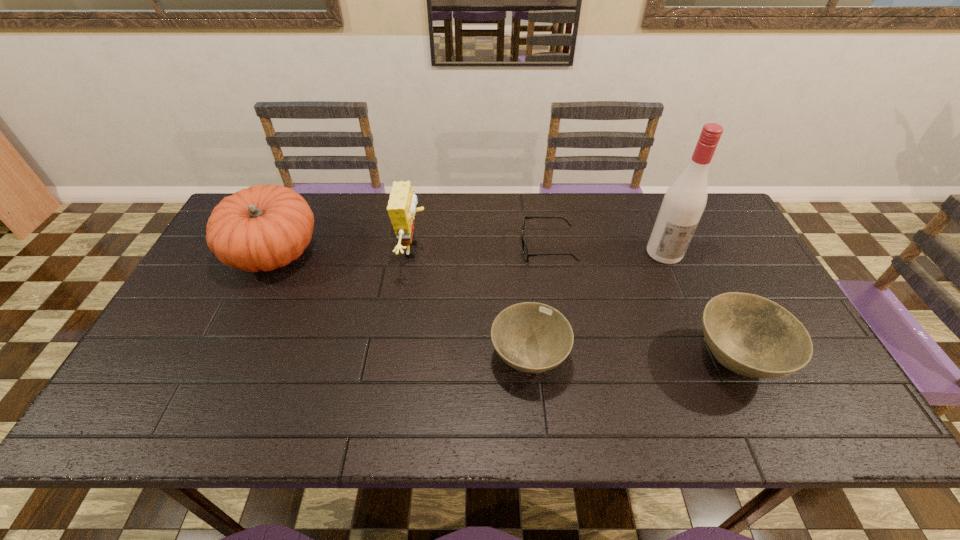
This screenshot has width=960, height=540. In order to click on free spot between the right bowl and the fifth object from right to left in this screenshot , I will do `click(574, 305)`.

Where is `free point between the right bowl and the sponge`? The height and width of the screenshot is (540, 960). free point between the right bowl and the sponge is located at coordinates (574, 305).

This screenshot has height=540, width=960. In order to click on free space between the pumpkin and the taller bowl in this screenshot , I will do `click(505, 306)`.

This screenshot has width=960, height=540. I want to click on free point between the leftmost object and the tallest object, so click(469, 253).

In order to click on empty space that is in between the tallest object and the sponge in this screenshot , I will do `click(540, 251)`.

Image resolution: width=960 pixels, height=540 pixels. Identify the location of unoccupied area between the shorter bowl and the fifth object from right to left. (471, 304).

Where is `object that is the second nearest to the spectacles`? This screenshot has width=960, height=540. object that is the second nearest to the spectacles is located at coordinates (531, 337).

Locate an element on the screen. object that stands as the fifth closest to the shortest object is located at coordinates (264, 227).

The height and width of the screenshot is (540, 960). Find the location of `vacant space that satisfies the following two spatial constraints: 1. on the label of the alcohol; 2. on the left side of the fourth tallest object`. vacant space that satisfies the following two spatial constraints: 1. on the label of the alcohol; 2. on the left side of the fourth tallest object is located at coordinates (709, 360).

The width and height of the screenshot is (960, 540). Find the location of `vacant position in the image that satisfies the following two spatial constraints: 1. on the face of the second object from left to right; 2. on the back side of the shorter bowl`. vacant position in the image that satisfies the following two spatial constraints: 1. on the face of the second object from left to right; 2. on the back side of the shorter bowl is located at coordinates (397, 359).